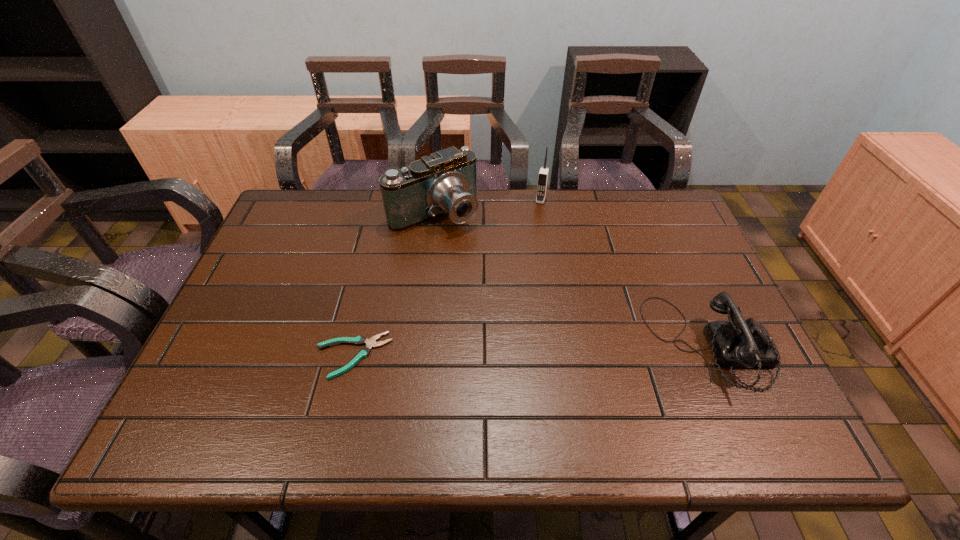
At what (x,y) coordinates should I click in order to perform the action: click on vacant space on the desktop that is between the pliers and the rightmost object and is positioned on the front-facing side of the camcorder. Please return your answer as a coordinate pair (x, y). Looking at the image, I should click on (560, 349).

You are a GUI agent. You are given a task and a screenshot of the screen. Output one action in this format:
    pyautogui.click(x=<x>, y=<y>)
    Task: Click on the vacant spot on the desktop that is between the shortest object and the telephone and is positioned on the front-facing side of the third object from left to right
    
    Given the screenshot: What is the action you would take?
    pyautogui.click(x=497, y=351)